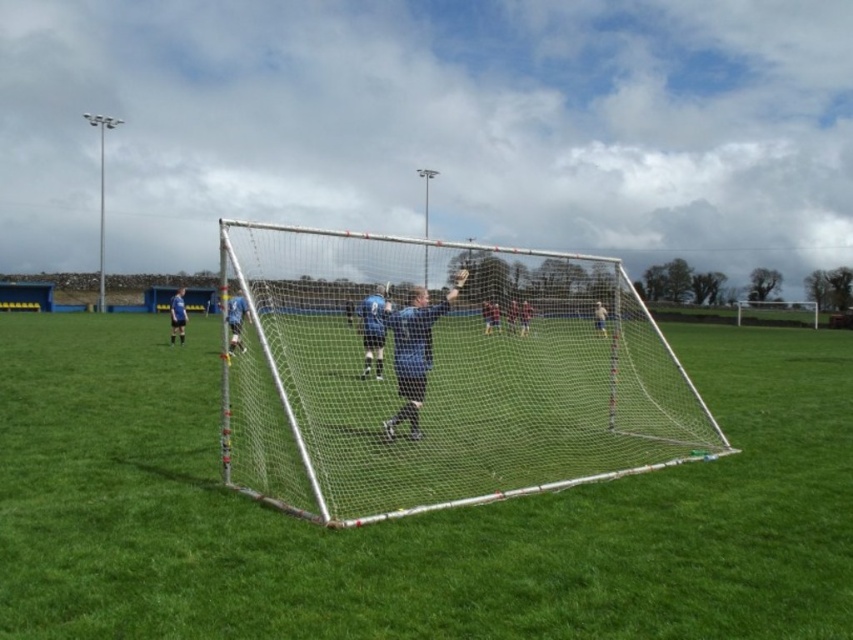
Does metallic silver goalpost at center have a lesser height compared to silver/mesh net at center?

Indeed, metallic silver goalpost at center has a lesser height compared to silver/mesh net at center.

Measure the distance between point (x=80, y=316) and camera.

52.52 meters

Between point (111, 540) and point (459, 294), which one is positioned behind?

Positioned behind is point (459, 294).

Identify the location of metallic silver goalpost at center. (410, 516).